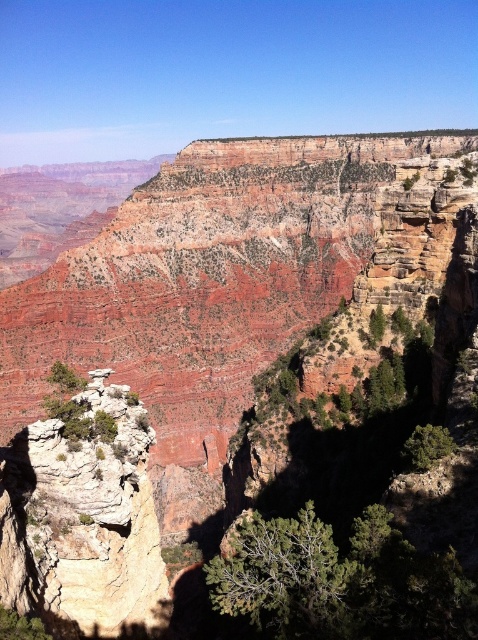
Question: Is green textured tree at lower center positioned in front of green matte tree at lower right?

Choices:
 (A) yes
 (B) no

Answer: (A)

Question: Estimate the real-world distances between objects in this image. Which object is farther from the green textured tree at lower center?

Choices:
 (A) rustic sandstone rock formation at center-left
 (B) green matte tree at lower right

Answer: (B)

Question: Which object is closer to the camera taking this photo?

Choices:
 (A) green matte tree at lower right
 (B) rustic sandstone rock formation at center-left
 (C) green textured tree at lower center

Answer: (C)

Question: Is the position of rustic sandstone rock formation at center-left less distant than that of green matte tree at lower right?

Choices:
 (A) yes
 (B) no

Answer: (A)

Question: Which point appears farthest from the camera in this image?

Choices:
 (A) (412, 465)
 (B) (308, 561)
 (C) (126, 445)

Answer: (A)

Question: Does rustic sandstone rock formation at center-left have a lesser width compared to green textured tree at lower center?

Choices:
 (A) no
 (B) yes

Answer: (A)